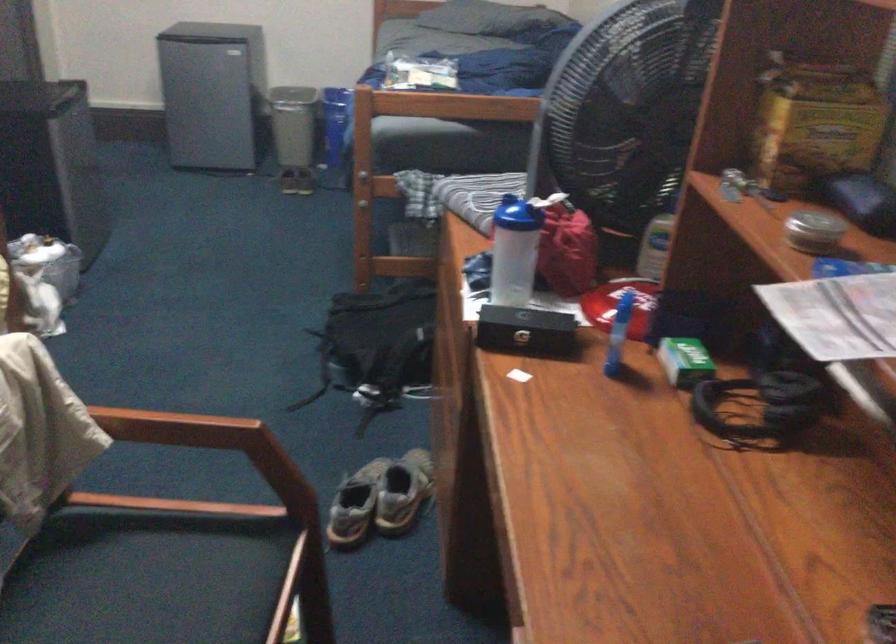
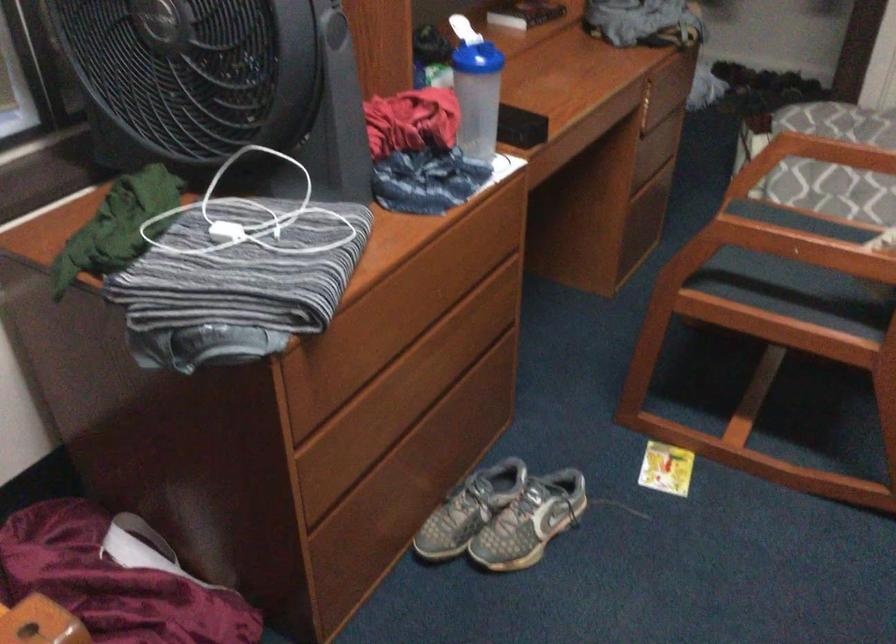
Question: I am providing you with two images of the same scene from different viewpoints. Which of the following objects are not visible in image2?

Choices:
 (A) wooden chair armrest
 (B) chair sitting surface
 (C) blue-lidded bottle
 (D) black ceramic bowl

Answer: (A)